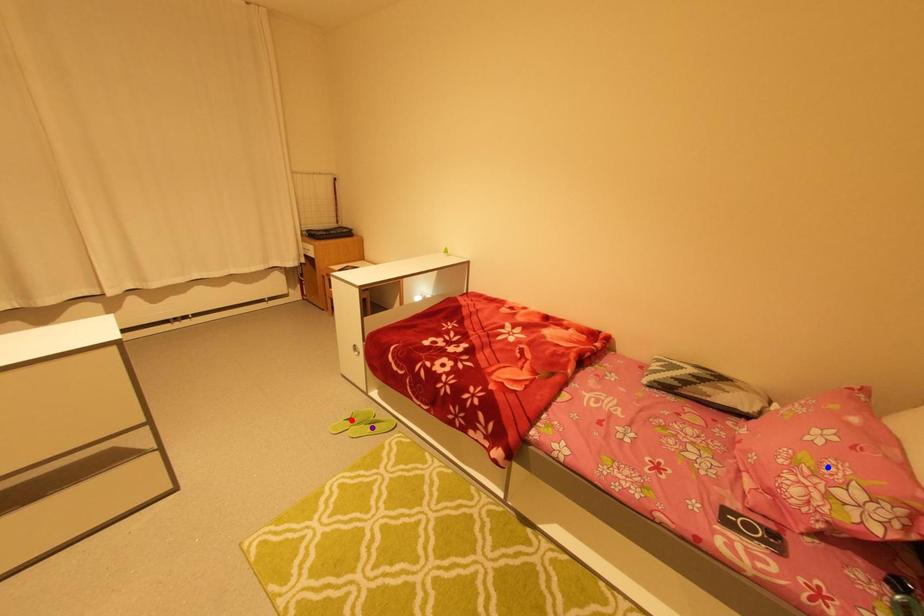
Order these from nearest to farthest:
A) purple point
B) red point
C) blue point

1. blue point
2. purple point
3. red point